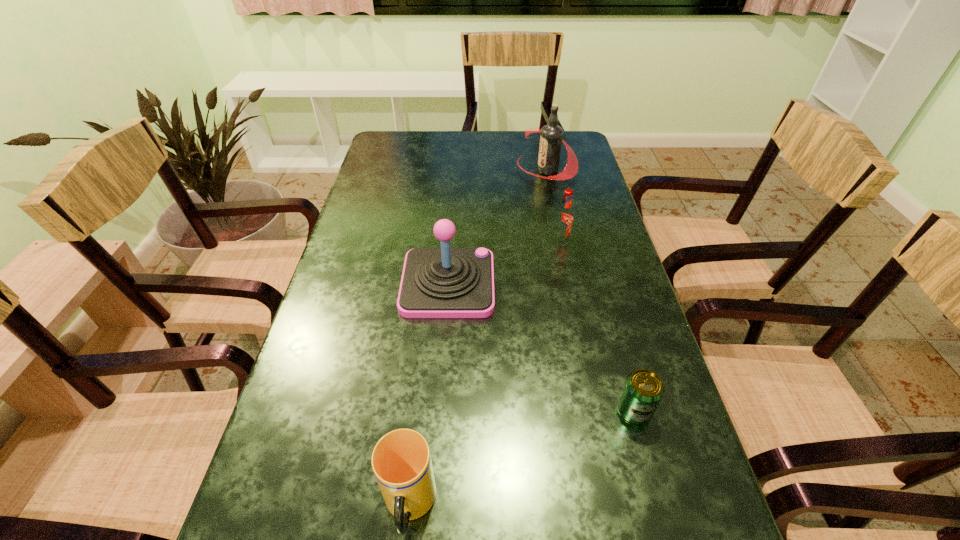
In the image, there is a desktop. Where is `blank space at the far left corner`? The width and height of the screenshot is (960, 540). blank space at the far left corner is located at coordinates (412, 134).

Find the location of a particular element. This screenshot has height=540, width=960. free space at the far right corner of the desktop is located at coordinates (563, 150).

Identify the location of vacant space that is in between the third farthest object and the nearer root beer. (505, 262).

Identify the location of free point between the beer can and the farther root beer. (590, 291).

I want to click on free space between the beer can and the fourth shortest object, so click(540, 347).

Where is `empty space between the farther root beer and the second tallest object`? The image size is (960, 540). empty space between the farther root beer and the second tallest object is located at coordinates (497, 227).

You are a GUI agent. You are given a task and a screenshot of the screen. Output one action in this format:
    pyautogui.click(x=<x>, y=<y>)
    Task: Click on the free spot between the shortest object and the second tallest object
    This screenshot has width=960, height=540.
    Given the screenshot: What is the action you would take?
    pyautogui.click(x=540, y=347)

The height and width of the screenshot is (540, 960). Find the location of `vacant region between the nearer root beer and the beer can`. vacant region between the nearer root beer and the beer can is located at coordinates (597, 326).

Image resolution: width=960 pixels, height=540 pixels. I want to click on vacant space that's between the shorter root beer and the shortest object, so [x=597, y=326].

Identify the location of object that is the second nearest to the shortest object. (401, 461).